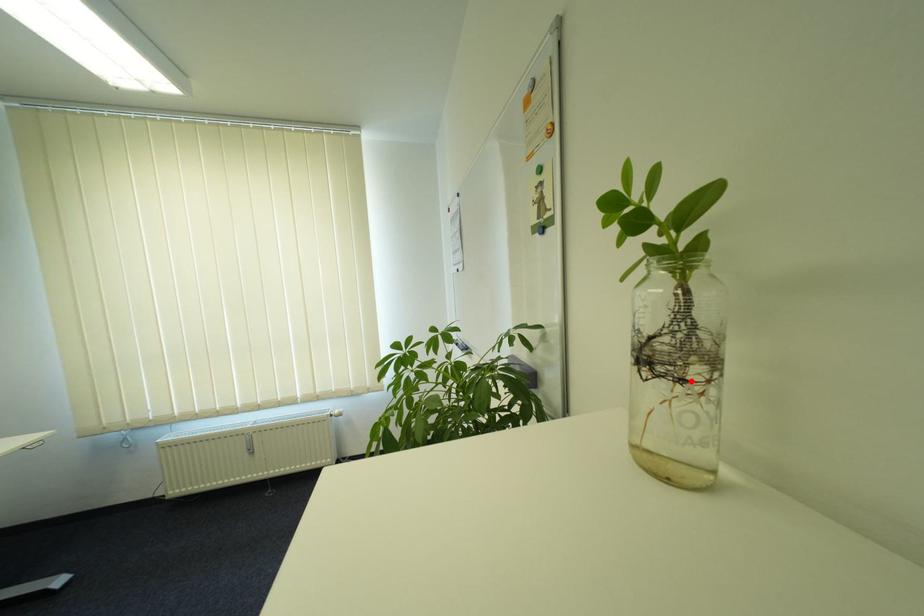
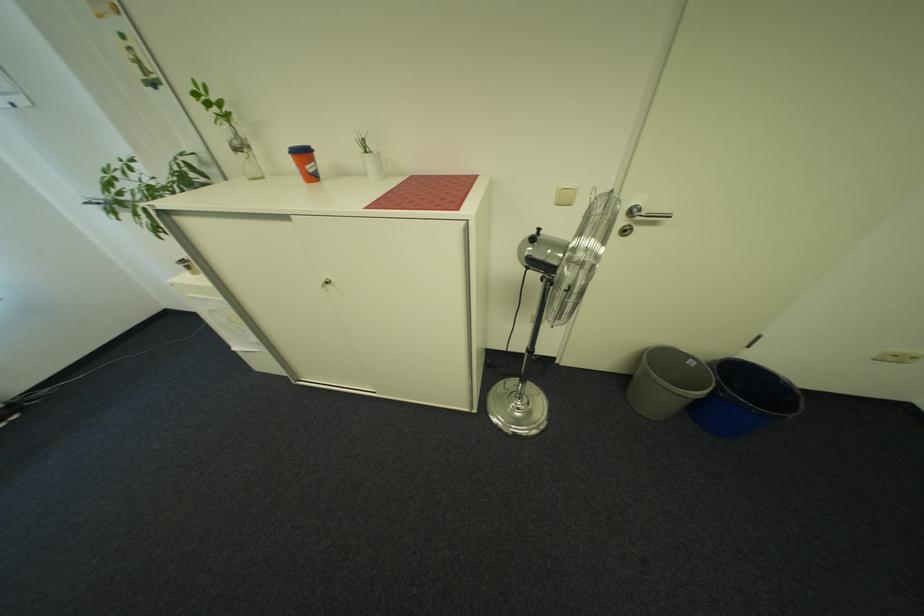
The point at the highlighted location is marked in the first image. Where is the corresponding point in the second image?

(252, 153)